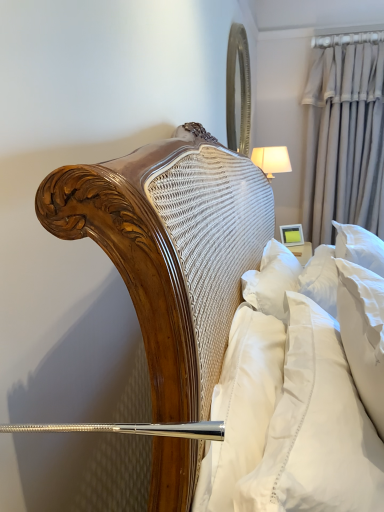
Question: Considering their positions, is beige fabric curtain at upper right located in front of or behind matte yellow picture frame at upper right?

Choices:
 (A) behind
 (B) front

Answer: (B)

Question: Is beige fabric curtain at upper right inside or outside of matte yellow picture frame at upper right?

Choices:
 (A) inside
 (B) outside

Answer: (B)

Question: Considering the real-world distances, which object is closest to the white soft pillow at right?

Choices:
 (A) matte yellow picture frame at upper right
 (B) silver/metallic mirror at upper right
 (C) white fabric lampshade at upper right
 (D) beige fabric curtain at upper right

Answer: (A)

Question: Which is farther from the silver/metallic mirror at upper right?

Choices:
 (A) white fabric lampshade at upper right
 (B) matte yellow picture frame at upper right
 (C) white soft pillow at right
 (D) beige fabric curtain at upper right

Answer: (C)